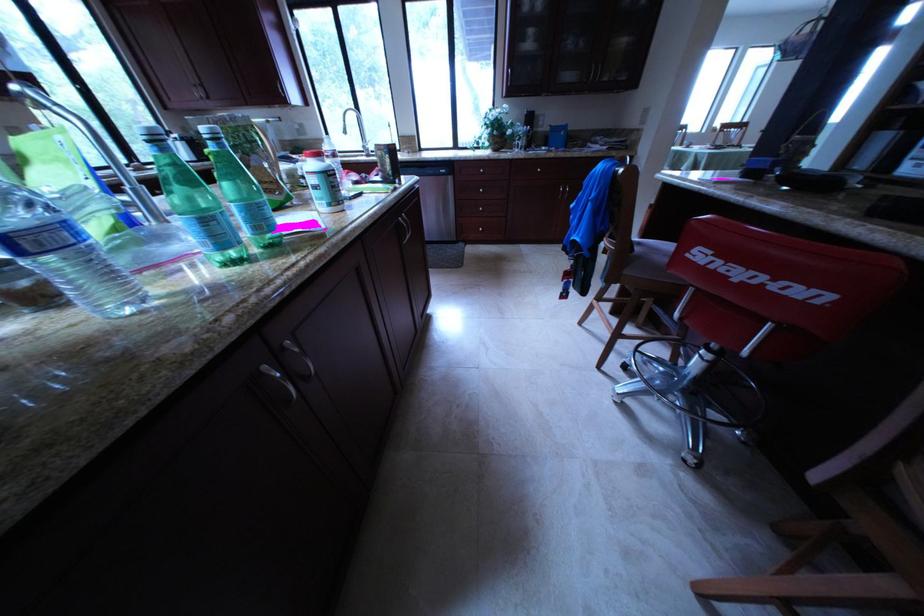
Find the location of a particular element. The image size is (924, 616). clear plastic bottle is located at coordinates (65, 254).